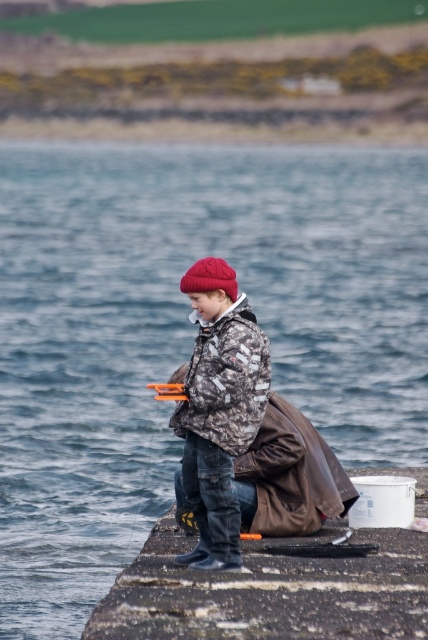
You are standing on the pier and want to hand a fishing lure to the child wearing both the camouflage jacket at center and the red woolen hat at center. Which item should you grab first to ensure you reach the correct person?

You should grab the red woolen hat at center first because the camouflage jacket at center is to the right of it, so the child wearing both items is located where the red woolen hat at center is positioned to the left of the camouflage jacket at center.

You are planning to take a photo of the child wearing both the camouflage jacket at center and the red woolen hat at center. Which clothing item has a greater width when viewed from the front?

The camouflage jacket at center has a greater width than the red woolen hat at center.

You are a photographer trying to capture a candid shot of the child fishing. You notice the camouflage jacket at center and the red woolen hat at center. Which item should you focus on to ensure the subject is fully visible in the frame?

The camouflage jacket at center is taller than the red woolen hat at center, so focusing on the camouflage jacket at center will ensure the subject is fully visible in the frame since it is taller and likely covers more of the child.